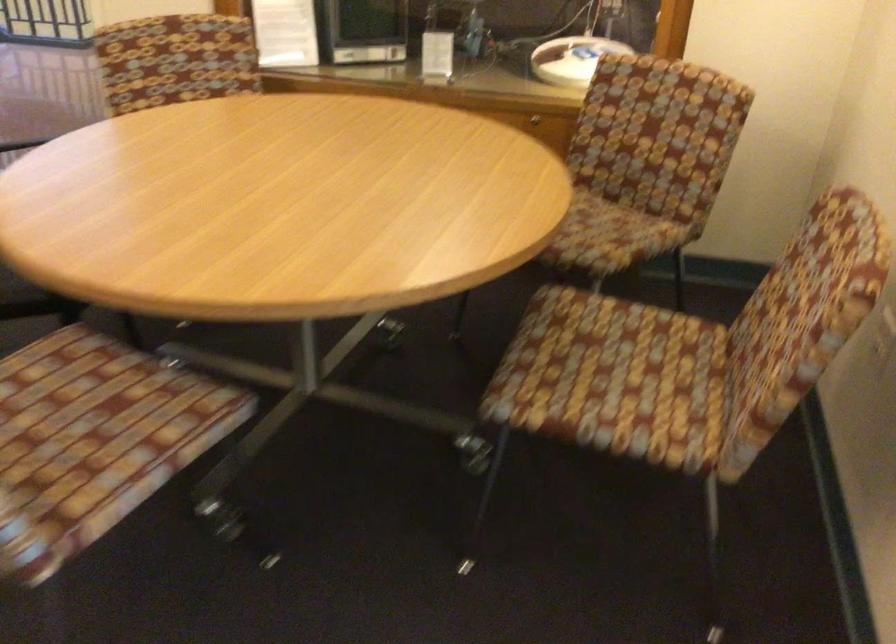
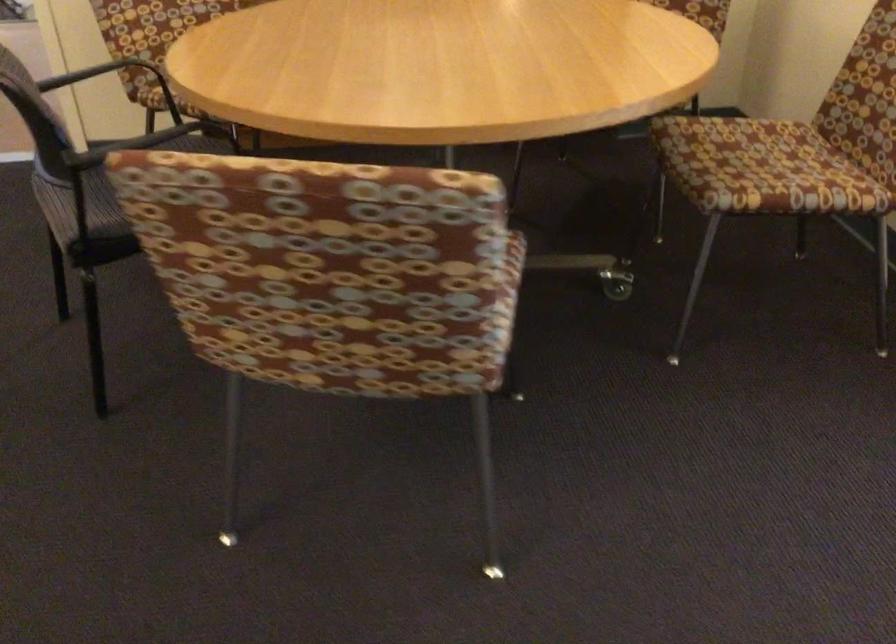
Locate, in the second image, the point that corresponds to point (579, 412) in the first image.

(778, 187)